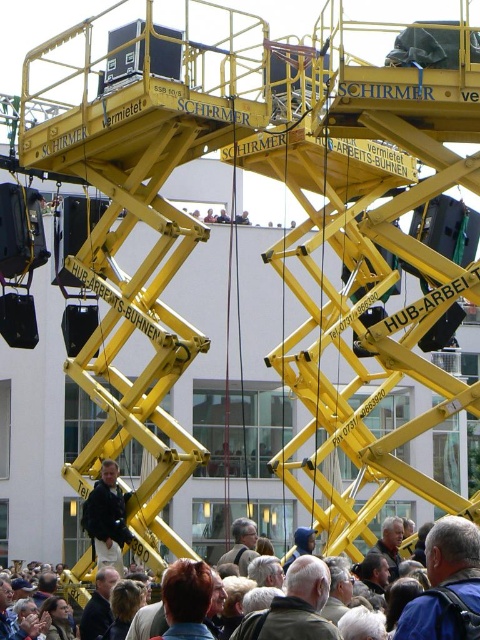
Between matte black crowd at lower center and dark blue jacket at center, which one appears on the left side from the viewer's perspective?

dark blue jacket at center is more to the left.

Consider the image. Can you confirm if matte black crowd at lower center is positioned below dark blue jacket at center?

Indeed, matte black crowd at lower center is positioned under dark blue jacket at center.

The image size is (480, 640). I want to click on matte black crowd at lower center, so click(x=446, y=586).